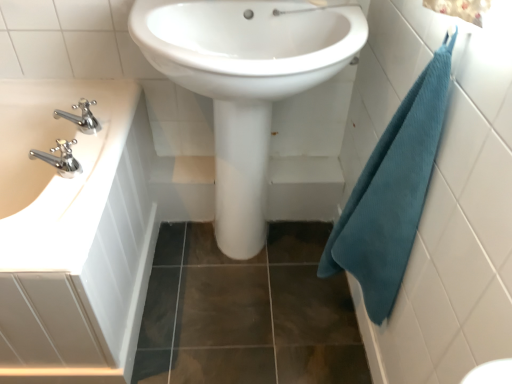
Question: Considering the positions of point (268, 104) and point (433, 147), is point (268, 104) closer or farther from the camera than point (433, 147)?

Choices:
 (A) closer
 (B) farther

Answer: (B)

Question: Do you think white glossy sink at center, positioned as the second sink in left-to-right order, is within teal waffle towel at right, or outside of it?

Choices:
 (A) inside
 (B) outside

Answer: (B)

Question: Which object is positioned closest to the chrome metallic faucet at left?

Choices:
 (A) white glossy sink at left, which ranks as the 2th sink in right-to-left order
 (B) teal waffle towel at right
 (C) white glossy sink at center, marked as the first sink in a right-to-left arrangement

Answer: (A)

Question: Which of these objects is positioned closest to the chrome metallic faucet at left?

Choices:
 (A) teal waffle towel at right
 (B) white glossy sink at left, placed as the first sink when sorted from left to right
 (C) white glossy sink at center, positioned as the second sink in left-to-right order

Answer: (B)